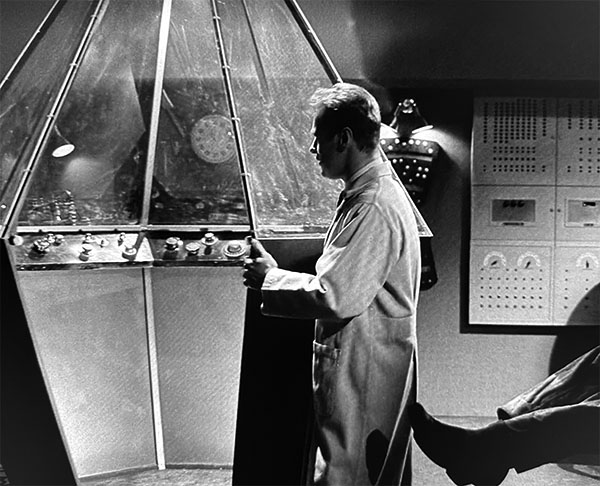
Identify the location of button of control panel right side. This screenshot has height=486, width=600. (236, 248), (212, 238), (190, 245), (176, 245).